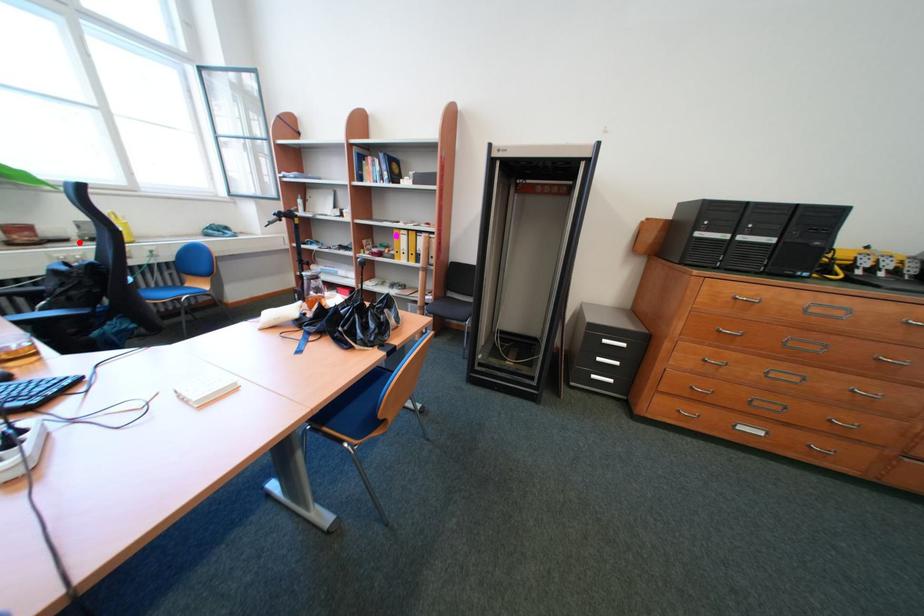
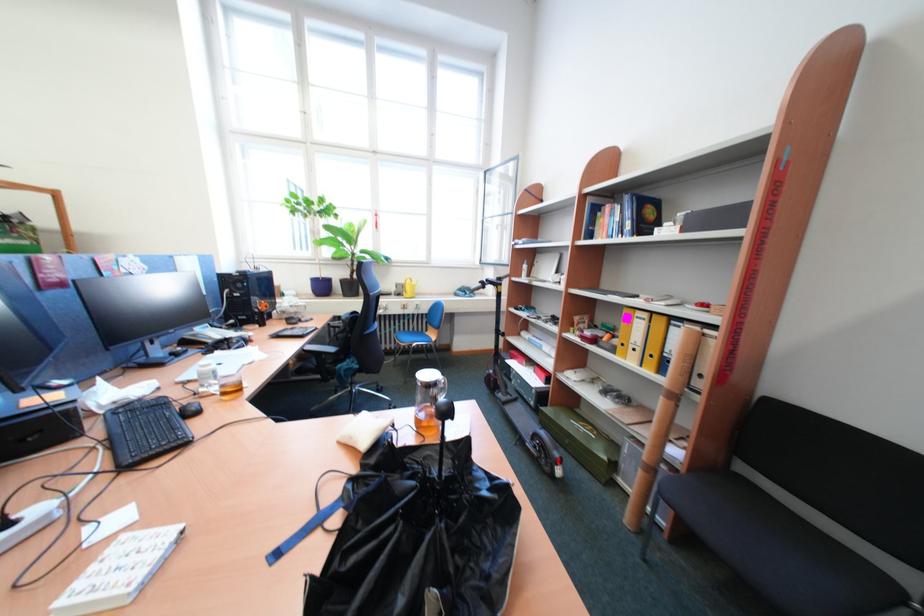
Question: I am providing you with two images of the same scene from different viewpoints. A red point is marked on the first image. At the location where the point appears in image 1, is it still visible in image 2?

Choices:
 (A) Yes
 (B) No

Answer: (A)